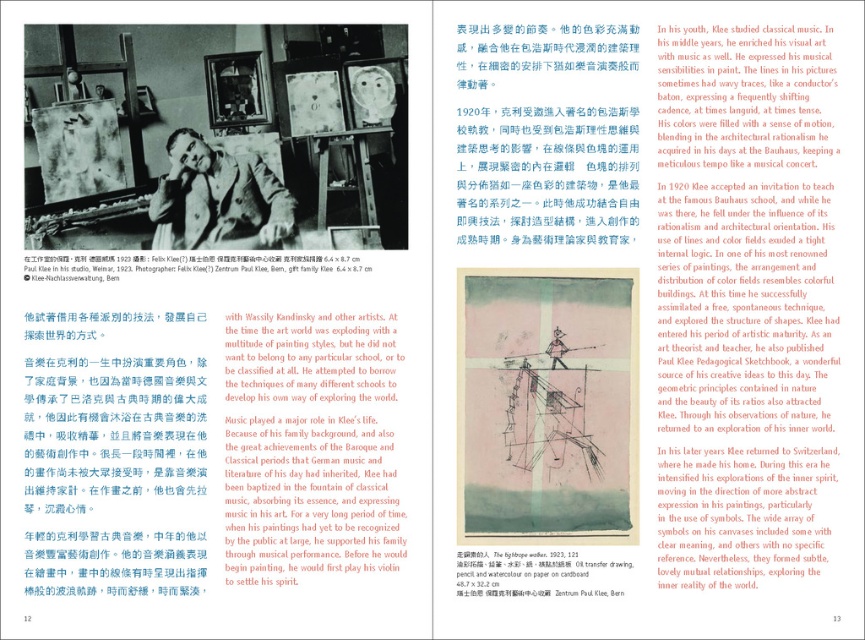
Which of these two, oil transfer drawing at upper center or oil transfer drawing, pencil and watercolor paper on cardboard at center, stands shorter?

oil transfer drawing, pencil and watercolor paper on cardboard at center is shorter.

What do you see at coordinates (207, 148) in the screenshot?
I see `oil transfer drawing at upper center` at bounding box center [207, 148].

You are a GUI agent. You are given a task and a screenshot of the screen. Output one action in this format:
    pyautogui.click(x=<x>, y=<y>)
    Task: Click on the oil transfer drawing at upper center
    Image resolution: width=865 pixels, height=640 pixels.
    Given the screenshot: What is the action you would take?
    pyautogui.click(x=207, y=148)

Which is below, watercolor paper at center or matte black photograph at upper left?

watercolor paper at center

Who is more distant from viewer, (565, 458) or (284, 272)?

Point (284, 272)

You are a GUI agent. You are given a task and a screenshot of the screen. Output one action in this format:
    pyautogui.click(x=<x>, y=<y>)
    Task: Click on the watercolor paper at center
    
    Given the screenshot: What is the action you would take?
    pyautogui.click(x=546, y=404)

Does matte black photograph at upper left appear on the left side of oil transfer drawing, pencil and watercolor paper on cardboard at center?

Correct, you'll find matte black photograph at upper left to the left of oil transfer drawing, pencil and watercolor paper on cardboard at center.

Which is below, matte black photograph at upper left or oil transfer drawing, pencil and watercolor paper on cardboard at center?

oil transfer drawing, pencil and watercolor paper on cardboard at center is lower down.

Between point (283, 259) and point (510, 582), which one is positioned in front?

Positioned in front is point (510, 582).

Locate an element on the screen. This screenshot has height=640, width=865. matte black photograph at upper left is located at coordinates (178, 264).